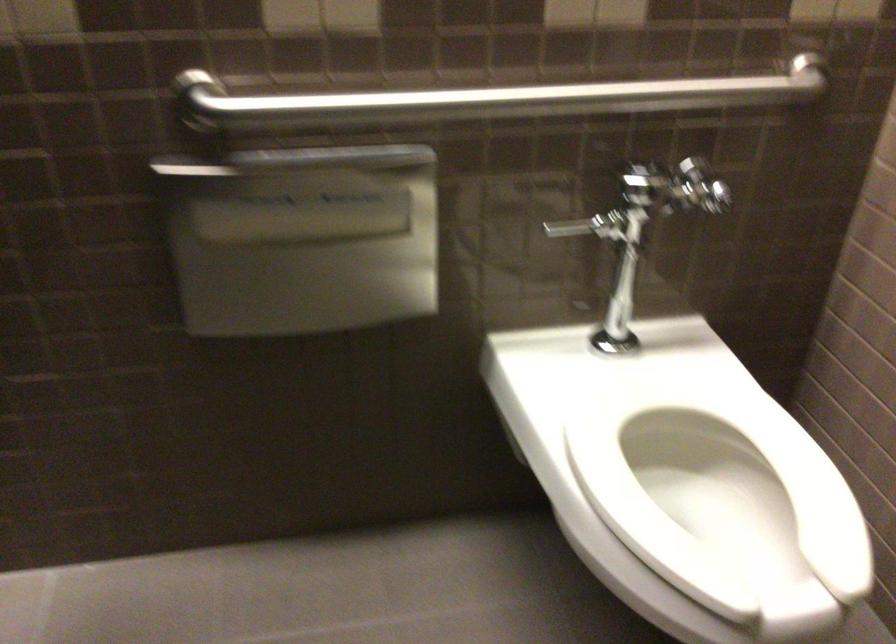
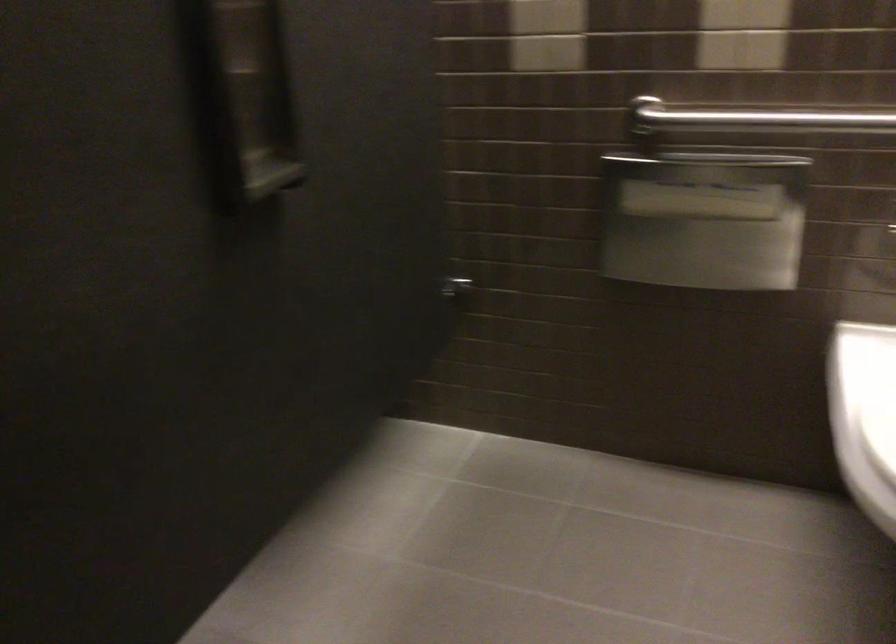
In the second image, find the point that corresponds to pixel 364 113 in the first image.

(751, 116)